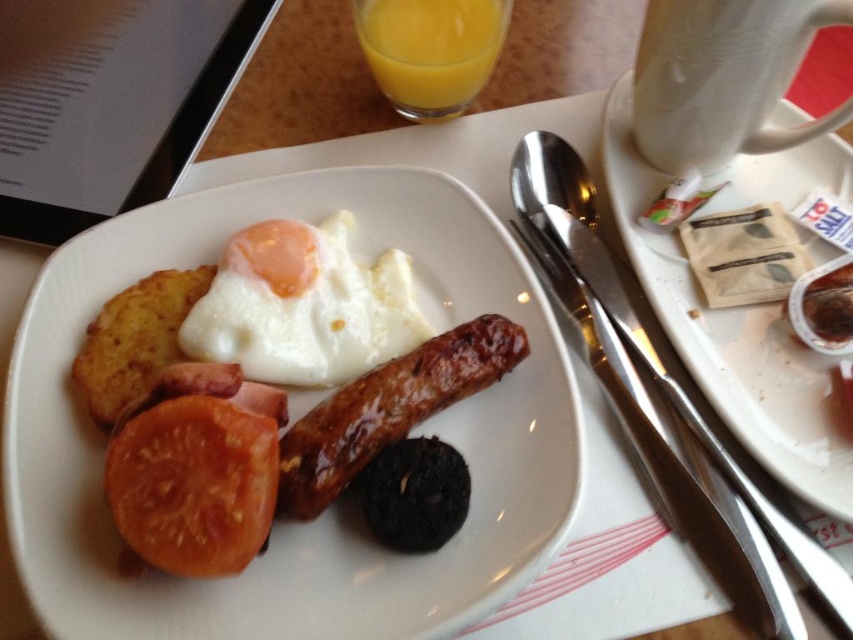
Question: Which object is positioned farthest from the slightly browned ceramic plate at center?

Choices:
 (A) white ceramic mug at upper right
 (B) golden brown fried potato at upper left
 (C) white smooth egg at center

Answer: (A)

Question: Can you confirm if white smooth egg at center is bigger than red matte tomato at lower left?

Choices:
 (A) yes
 (B) no

Answer: (A)

Question: Does white ceramic plate at upper center appear on the left side of white ceramic mug at upper right?

Choices:
 (A) no
 (B) yes

Answer: (A)

Question: Does white ceramic mug at upper right have a smaller size compared to brown glossy sausage at center?

Choices:
 (A) no
 (B) yes

Answer: (A)

Question: Which object is closer to the camera taking this photo?

Choices:
 (A) white ceramic mug at upper right
 (B) white smooth egg at center
 (C) white ceramic plate at upper center

Answer: (C)

Question: Which of the following is the farthest from the observer?

Choices:
 (A) (450, 84)
 (B) (128, 305)
 (C) (306, 348)
 (D) (824, 454)

Answer: (A)